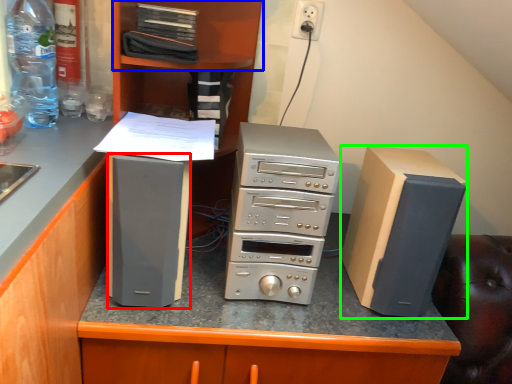
Question: Considering the real-world distances, which object is closest to appliance (highlighted by a red box)? shelf (highlighted by a blue box) or computer tower (highlighted by a green box).

Choices:
 (A) shelf
 (B) computer tower

Answer: (B)